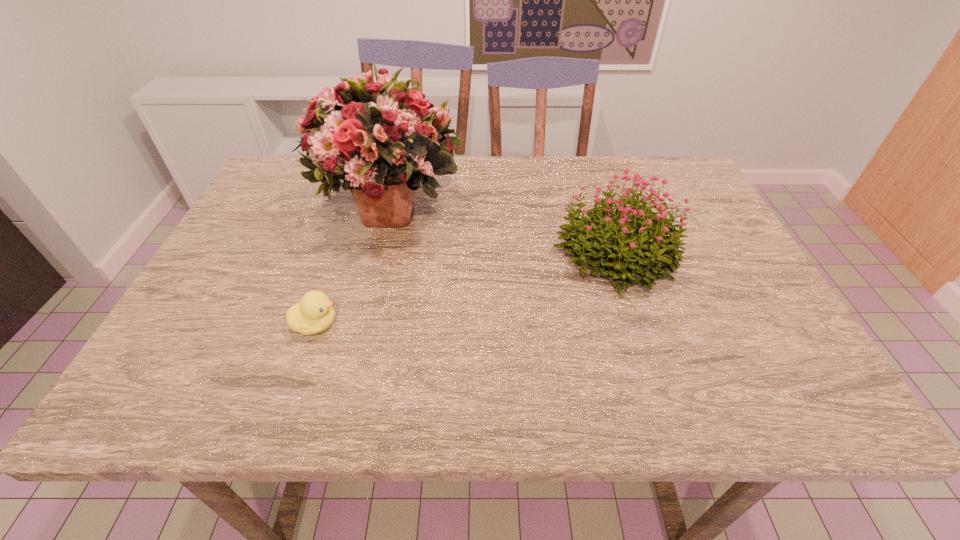
What are the coordinates of `the tallest object` in the screenshot? It's located at (383, 139).

Identify the location of the left bouquet. This screenshot has height=540, width=960. (383, 139).

Locate an element on the screen. The height and width of the screenshot is (540, 960). the shorter bouquet is located at coordinates (635, 246).

You are a GUI agent. You are given a task and a screenshot of the screen. Output one action in this format:
    pyautogui.click(x=<x>, y=<y>)
    Task: Click on the second tallest object
    The height and width of the screenshot is (540, 960).
    Given the screenshot: What is the action you would take?
    pyautogui.click(x=635, y=246)

At what (x,y) coordinates should I click in order to perform the action: click on the shortest object. Please return your answer as a coordinate pair (x, y). The image size is (960, 540). Looking at the image, I should click on (314, 313).

The width and height of the screenshot is (960, 540). I want to click on duckling, so click(314, 313).

Where is `vacant space situated on the left of the taller bouquet`? This screenshot has width=960, height=540. vacant space situated on the left of the taller bouquet is located at coordinates (271, 206).

You are a GUI agent. You are given a task and a screenshot of the screen. Output one action in this format:
    pyautogui.click(x=<x>, y=<y>)
    Task: Click on the vacant space located 0.090m on the back of the second shortest object
    
    Given the screenshot: What is the action you would take?
    pyautogui.click(x=596, y=197)

Find the location of a particular element. This screenshot has width=960, height=540. free space located 0.340m at the beak of the nearest object is located at coordinates (509, 324).

I want to click on object that is positioned at the far edge, so click(x=383, y=139).